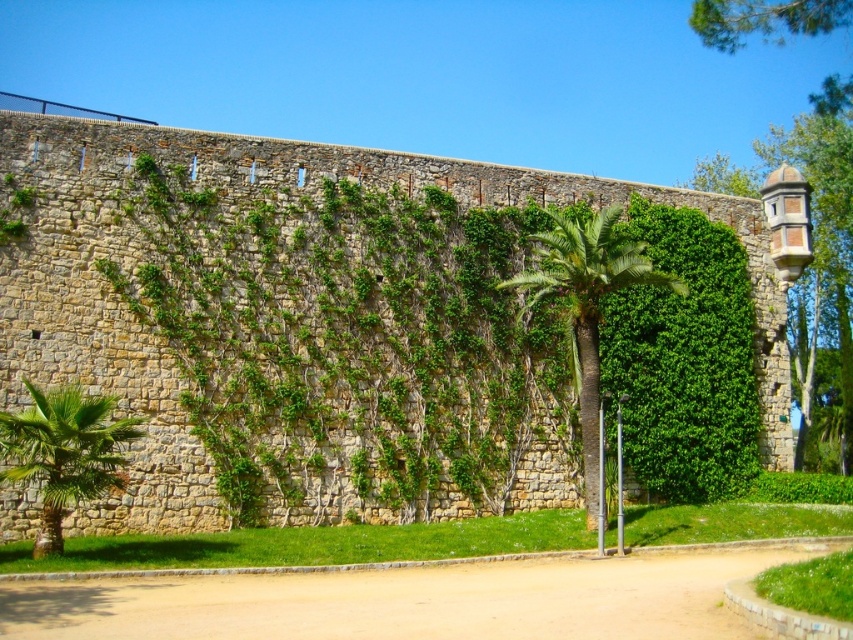
You are standing in front of the stone wall and want to place a small bench exactly at the center of the grassy area. The green leafy palm at center is currently at point 0.489, 0.689. Is the palm tree blocking the bench placement at the center?

The green leafy palm at center is located at point (x=587, y=312), which is not the exact center of the grassy area. Therefore, the palm tree is not blocking the bench placement at the center.

You are standing in front of the stone wall and want to place a small birdhouse on the shorter object between the green leafy palm at center and the metallic pole at lower center. Which object should you choose?

The metallic pole at lower center is shorter than the green leafy palm at center, so you should place the birdhouse on the metallic pole at lower center.

You are standing at the base of the historical stone wall and want to walk towards the grassy area in front of you. Which direction should you go relative to the metallic pole at lower center to reach the brown dirt path at center?

To reach the brown dirt path at center, you should go to the left of the metallic pole at lower center since the brown dirt path at center is located to the left of it.